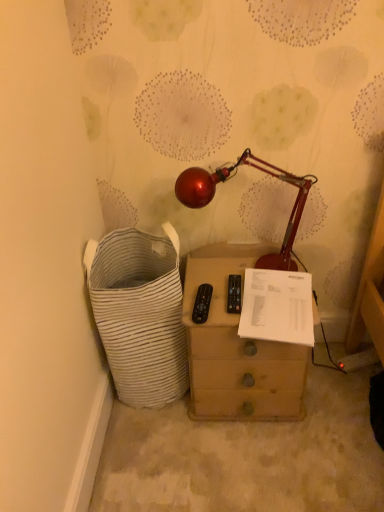
This screenshot has width=384, height=512. Describe the element at coordinates (277, 307) in the screenshot. I see `white paper at center` at that location.

Locate an element on the screen. white striped fabric laundry basket at left is located at coordinates (140, 313).

The image size is (384, 512). I want to click on wooden chest of drawers at center, so click(236, 348).

I want to click on document behind the white striped fabric laundry basket at left, so click(x=277, y=307).

Does white striped fabric laundry basket at left have a larger size compared to white paper at center?

Indeed, white striped fabric laundry basket at left has a larger size compared to white paper at center.

Is white striped fabric laundry basket at left in front of or behind white paper at center in the image?

white striped fabric laundry basket at left is positioned closer to the viewer than white paper at center.

Does white striped fabric laundry basket at left turn towards white paper at center?

No, white striped fabric laundry basket at left is not aimed at white paper at center.

Which is more to the left, wooden chest of drawers at center or white paper at center?

wooden chest of drawers at center.

Is the depth of wooden chest of drawers at center greater than that of white paper at center?

Yes, wooden chest of drawers at center is further from the viewer.

Considering the positions of points (226, 419) and (284, 300), is point (226, 419) farther from camera compared to point (284, 300)?

Yes, point (226, 419) is behind point (284, 300).

Between wooden chest of drawers at center and white paper at center, which one has larger width?

Wider between the two is wooden chest of drawers at center.

Is shiny metallic lamp at center not near white paper at center?

That's not correct — shiny metallic lamp at center is a little close to white paper at center.

Considering the positions of objects shiny metallic lamp at center and white paper at center in the image provided, who is more to the left, shiny metallic lamp at center or white paper at center?

shiny metallic lamp at center.

Is shiny metallic lamp at center in front of or behind white paper at center in the image?

shiny metallic lamp at center is positioned closer to the viewer than white paper at center.

Are wooden chest of drawers at center and white striped fabric laundry basket at left making contact?

No, wooden chest of drawers at center is not next to white striped fabric laundry basket at left.

Does wooden chest of drawers at center appear on the left side of white striped fabric laundry basket at left?

No, wooden chest of drawers at center is not to the left of white striped fabric laundry basket at left.

Which object is wider, wooden chest of drawers at center or white striped fabric laundry basket at left?

white striped fabric laundry basket at left.

Can you confirm if wooden chest of drawers at center is shorter than white striped fabric laundry basket at left?

Yes.

Is white striped fabric laundry basket at left not within wooden chest of drawers at center?

Absolutely, white striped fabric laundry basket at left is external to wooden chest of drawers at center.

Which is less distant, (128, 248) or (221, 306)?

Positioned in front is point (221, 306).

Measure the distance from white striped fabric laundry basket at left to wooden chest of drawers at center.

white striped fabric laundry basket at left is 7.58 inches away from wooden chest of drawers at center.

Does white striped fabric laundry basket at left appear on the right side of wooden chest of drawers at center?

Incorrect, white striped fabric laundry basket at left is not on the right side of wooden chest of drawers at center.

Which of these two, white paper at center or white striped fabric laundry basket at left, is bigger?

Bigger between the two is white striped fabric laundry basket at left.

From the image's perspective, which one is positioned higher, white paper at center or white striped fabric laundry basket at left?

white paper at center is shown above in the image.

From the picture: How distant is white paper at center from white striped fabric laundry basket at left?

white paper at center and white striped fabric laundry basket at left are 14.54 inches apart.

From a real-world perspective, is white paper at center under white striped fabric laundry basket at left?

Incorrect, from a real-world perspective, white paper at center is higher than white striped fabric laundry basket at left.

Is white paper at center positioned behind wooden chest of drawers at center?

No, white paper at center is closer to the camera.

From the image's perspective, which object appears higher, white paper at center or wooden chest of drawers at center?

white paper at center, from the image's perspective.

Which point is more forward, (272,303) or (274,343)?

The point (274,343) is more forward.

Considering the positions of objects white paper at center and wooden chest of drawers at center in the image provided, who is more to the right, white paper at center or wooden chest of drawers at center?

Positioned to the right is white paper at center.

Where is `laundry basket located below the white paper at center (from the image's perspective)`? The width and height of the screenshot is (384, 512). laundry basket located below the white paper at center (from the image's perspective) is located at coordinates (140, 313).

This screenshot has width=384, height=512. Identify the location of the chest of drawers beneath the white paper at center (from a real-world perspective). (236, 348).

Based on their spatial positions, is wooden chest of drawers at center or shiny metallic lamp at center closer to white paper at center?

wooden chest of drawers at center is closer to white paper at center.

Estimate the real-world distances between objects in this image. Which object is further from white paper at center, wooden chest of drawers at center or white striped fabric laundry basket at left?

The object further to white paper at center is white striped fabric laundry basket at left.

Considering their positions, is white striped fabric laundry basket at left positioned further to white paper at center than wooden chest of drawers at center?

white striped fabric laundry basket at left is positioned further to the anchor white paper at center.

In the scene shown: Looking at the image, which one is located closer to wooden chest of drawers at center, white striped fabric laundry basket at left or shiny metallic lamp at center?

white striped fabric laundry basket at left lies closer to wooden chest of drawers at center than the other object.

Which object lies nearer to the anchor point white paper at center, shiny metallic lamp at center or white striped fabric laundry basket at left?

Based on the image, shiny metallic lamp at center appears to be nearer to white paper at center.

Which object lies nearer to the anchor point white striped fabric laundry basket at left, wooden chest of drawers at center or shiny metallic lamp at center?

Among the two, wooden chest of drawers at center is located nearer to white striped fabric laundry basket at left.

Considering their positions, is white paper at center positioned closer to shiny metallic lamp at center than wooden chest of drawers at center?

white paper at center is closer to shiny metallic lamp at center.

Estimate the real-world distances between objects in this image. Which object is closer to white striped fabric laundry basket at left, white paper at center or shiny metallic lamp at center?

The object closer to white striped fabric laundry basket at left is white paper at center.

This screenshot has height=512, width=384. I want to click on lamp located between white striped fabric laundry basket at left and white paper at center in the left-right direction, so click(227, 179).

The image size is (384, 512). What are the coordinates of `laundry basket between shiny metallic lamp at center and wooden chest of drawers at center in the up-down direction` in the screenshot? It's located at (140, 313).

The width and height of the screenshot is (384, 512). What are the coordinates of `document between shiny metallic lamp at center and wooden chest of drawers at center in the up-down direction` in the screenshot? It's located at (277, 307).

Where is `the chest of drawers located between white striped fabric laundry basket at left and white paper at center in the left-right direction`? the chest of drawers located between white striped fabric laundry basket at left and white paper at center in the left-right direction is located at coordinates (236, 348).